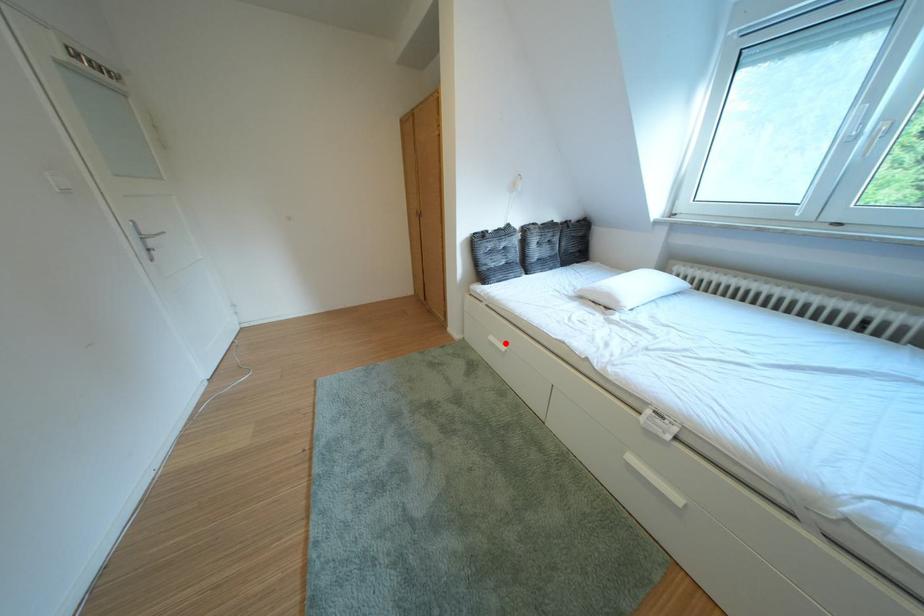
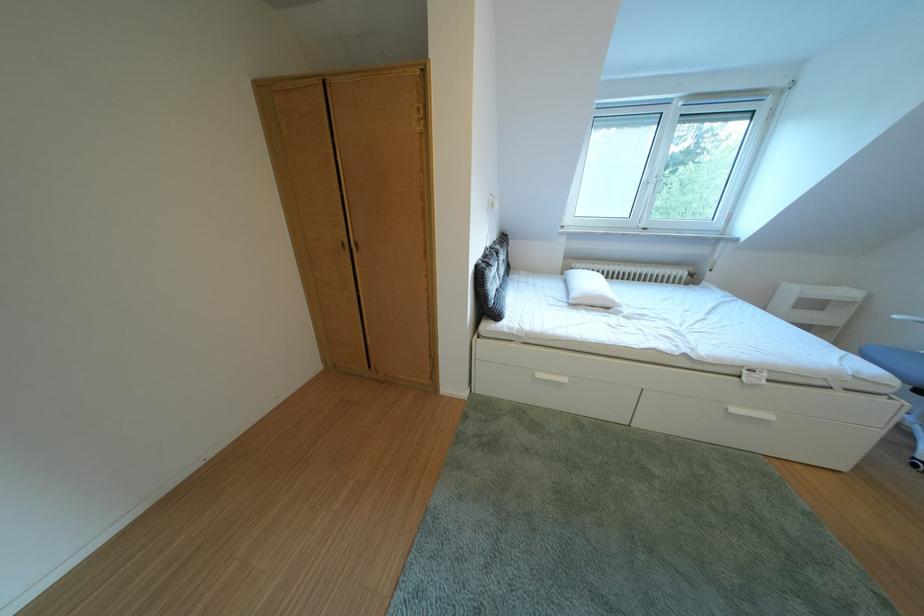
Find the pixel in the second image that matches the highlighted location in the first image.

(553, 381)